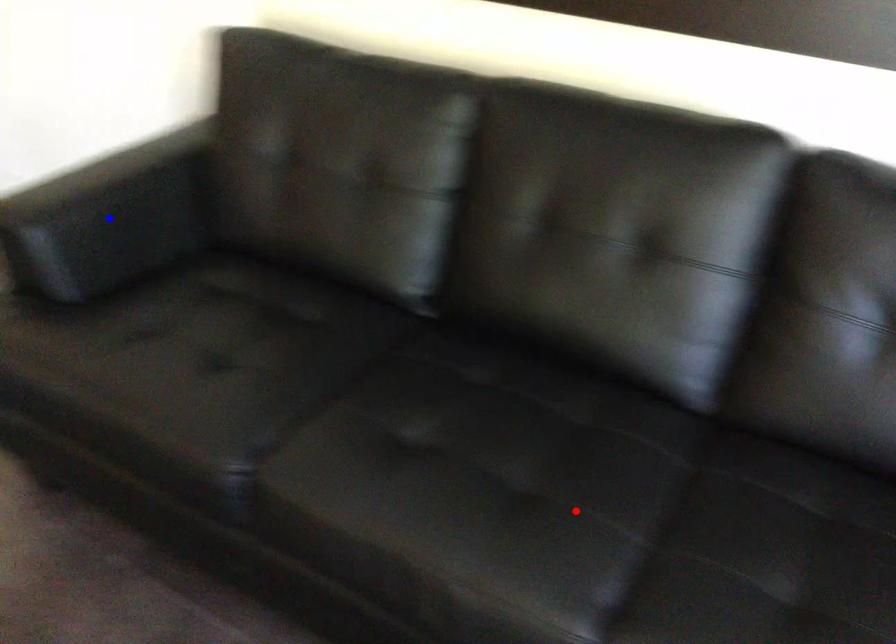
Question: Two points are marked on the image. Which point is closer to the camera?

Choices:
 (A) Blue point is closer.
 (B) Red point is closer.

Answer: (B)